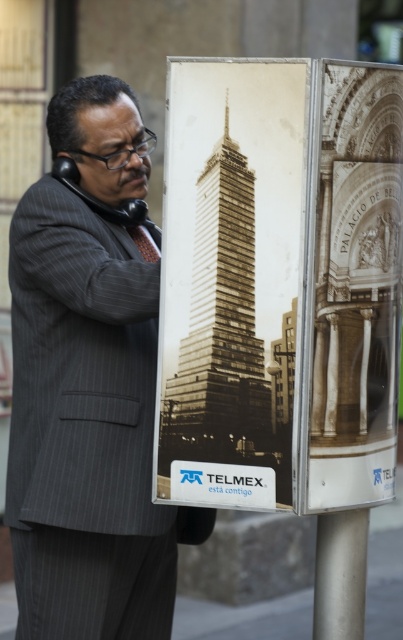
Is gray pinstripe suit at center to the right of satin silver pole at lower center from the viewer's perspective?

Incorrect, gray pinstripe suit at center is not on the right side of satin silver pole at lower center.

Does gray pinstripe suit at center have a greater height compared to satin silver pole at lower center?

Correct, gray pinstripe suit at center is much taller as satin silver pole at lower center.

You are a GUI agent. You are given a task and a screenshot of the screen. Output one action in this format:
    pyautogui.click(x=<x>, y=<y>)
    Task: Click on the gray pinstripe suit at center
    This screenshot has width=403, height=640.
    Given the screenshot: What is the action you would take?
    pyautogui.click(x=89, y=385)

Can you confirm if gray pinstripe suit at center is positioned to the left of sepia-toned photograph of building at center?

Yes, gray pinstripe suit at center is to the left of sepia-toned photograph of building at center.

Is gray pinstripe suit at center behind sepia-toned photograph of building at center?

Yes, it is behind sepia-toned photograph of building at center.

Where is `gray pinstripe suit at center`? The image size is (403, 640). gray pinstripe suit at center is located at coordinates (89, 385).

Locate an element on the screen. The image size is (403, 640). gray pinstripe suit at center is located at coordinates (89, 385).

Does sepia-toned photograph of building at center appear under satin silver pole at lower center?

No, sepia-toned photograph of building at center is not below satin silver pole at lower center.

Is sepia-toned photograph of building at center shorter than satin silver pole at lower center?

In fact, sepia-toned photograph of building at center may be taller than satin silver pole at lower center.

Locate an element on the screen. sepia-toned photograph of building at center is located at coordinates (230, 280).